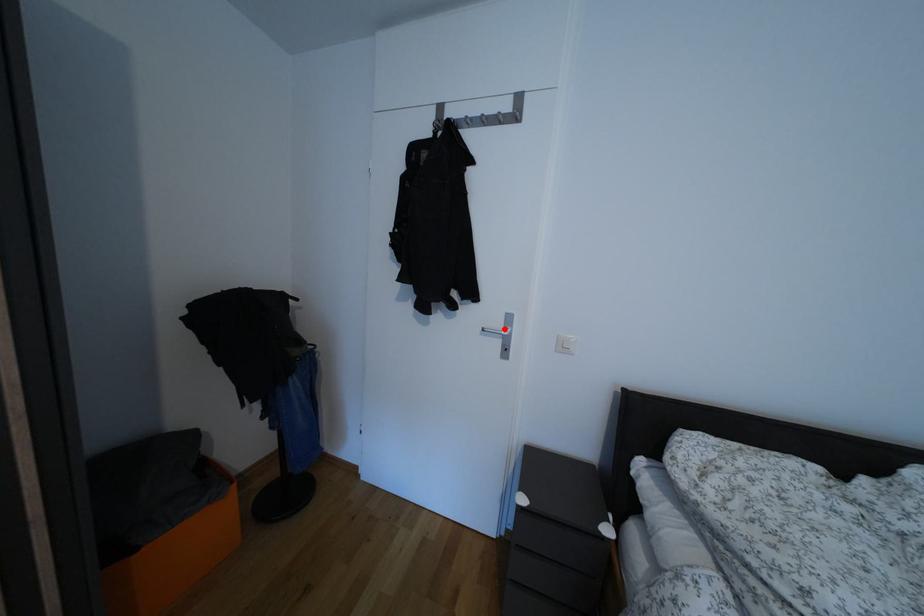
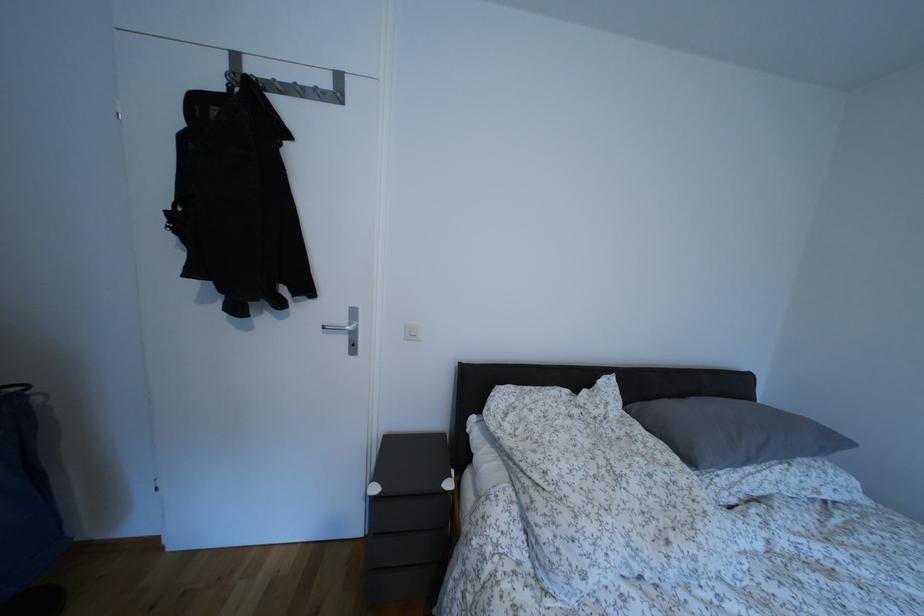
Find the pixel in the second image that matches the highlighted location in the first image.

(348, 325)